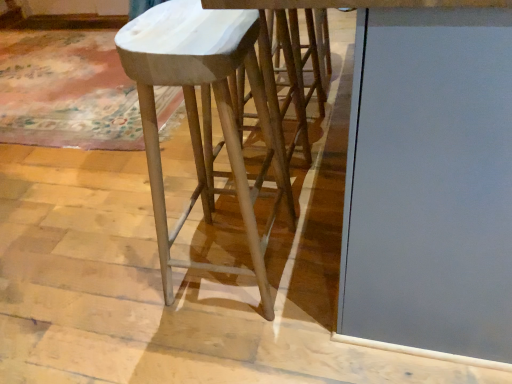
Locate an element on the screen. matte gray glass door at center is located at coordinates (430, 183).

The width and height of the screenshot is (512, 384). What do you see at coordinates (430, 183) in the screenshot?
I see `matte gray glass door at center` at bounding box center [430, 183].

This screenshot has height=384, width=512. Describe the element at coordinates (203, 115) in the screenshot. I see `white marble stool at center` at that location.

You are a GUI agent. You are given a task and a screenshot of the screen. Output one action in this format:
    pyautogui.click(x=<x>, y=<y>)
    Task: Click on the white marble stool at center
    Image resolution: width=512 pixels, height=384 pixels.
    Given the screenshot: What is the action you would take?
    pyautogui.click(x=203, y=115)

This screenshot has height=384, width=512. I want to click on matte gray glass door at center, so click(x=430, y=183).

Can you confirm if matte gray glass door at center is positioned to the left of white marble stool at center?

In fact, matte gray glass door at center is to the right of white marble stool at center.

Between matte gray glass door at center and white marble stool at center, which one is positioned behind?

white marble stool at center is behind.

Considering the points (459, 222) and (212, 161), which point is in front, point (459, 222) or point (212, 161)?

Point (459, 222)

In the scene shown: From the image's perspective, is matte gray glass door at center below white marble stool at center?

Incorrect, from the image's perspective, matte gray glass door at center is higher than white marble stool at center.

From the picture: From a real-world perspective, who is located higher, matte gray glass door at center or white marble stool at center?

In real-world perspective, matte gray glass door at center is above.

Considering the sizes of objects matte gray glass door at center and white marble stool at center in the image provided, who is wider, matte gray glass door at center or white marble stool at center?

matte gray glass door at center is wider.

Is matte gray glass door at center taller than white marble stool at center?

Yes, matte gray glass door at center is taller than white marble stool at center.

Between matte gray glass door at center and white marble stool at center, which one has larger size?

matte gray glass door at center.

Is matte gray glass door at center inside the boundaries of white marble stool at center, or outside?

matte gray glass door at center is located beyond the bounds of white marble stool at center.

Is matte gray glass door at center far away from white marble stool at center?

matte gray glass door at center is actually quite close to white marble stool at center.

Is matte gray glass door at center facing away from white marble stool at center?

No.

Measure the distance between matte gray glass door at center and white marble stool at center.

17.66 inches.

The image size is (512, 384). I want to click on glass door lying in front of the white marble stool at center, so click(430, 183).

Considering the positions of objects white marble stool at center and matte gray glass door at center in the image provided, who is more to the left, white marble stool at center or matte gray glass door at center?

Positioned to the left is white marble stool at center.

Considering the relative positions of white marble stool at center and matte gray glass door at center in the image provided, is white marble stool at center in front of matte gray glass door at center?

No, white marble stool at center is further to the viewer.

Does point (156, 33) come closer to viewer compared to point (400, 169)?

No, it is not.

From the image's perspective, is white marble stool at center above matte gray glass door at center?

No, from the image's perspective, white marble stool at center is not over matte gray glass door at center.

From a real-world perspective, is white marble stool at center physically below matte gray glass door at center?

Correct, in the physical world, white marble stool at center is lower than matte gray glass door at center.

Considering the sizes of white marble stool at center and matte gray glass door at center in the image, is white marble stool at center wider or thinner than matte gray glass door at center?

In the image, white marble stool at center appears to be more narrow than matte gray glass door at center.

Does white marble stool at center have a greater height compared to matte gray glass door at center?

No, white marble stool at center is not taller than matte gray glass door at center.

Who is bigger, white marble stool at center or matte gray glass door at center?

matte gray glass door at center.

From the picture: Would you say matte gray glass door at center is part of white marble stool at center's contents?

Definitely not — matte gray glass door at center is not inside white marble stool at center.

Is white marble stool at center next to matte gray glass door at center and touching it?

No, white marble stool at center is not next to matte gray glass door at center.

Looking at this image, is white marble stool at center facing towards matte gray glass door at center?

Yes, white marble stool at center faces towards matte gray glass door at center.

Locate an element on the screen. This screenshot has height=384, width=512. glass door on the right of the white marble stool at center is located at coordinates [x=430, y=183].

You are a GUI agent. You are given a task and a screenshot of the screen. Output one action in this format:
    pyautogui.click(x=<x>, y=<y>)
    Task: Click on the glass door above the white marble stool at center (from the image's perspective)
    The height and width of the screenshot is (384, 512).
    Given the screenshot: What is the action you would take?
    pyautogui.click(x=430, y=183)

Identify the location of stool that appears behind the matte gray glass door at center. The height and width of the screenshot is (384, 512). (203, 115).